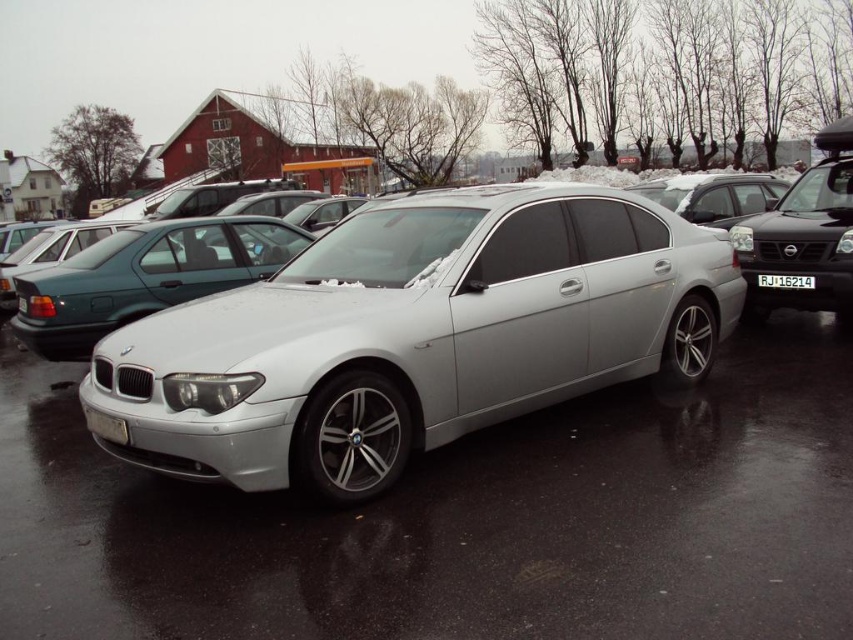
Does satin silver sedan at center appear over white plastic license plate at center?

Incorrect, satin silver sedan at center is not positioned above white plastic license plate at center.

Does point (460, 326) lie behind point (811, 282)?

No, (460, 326) is in front of (811, 282).

Is point (517, 284) positioned before point (779, 278)?

Yes, it is.

Identify the location of satin silver sedan at center. (413, 337).